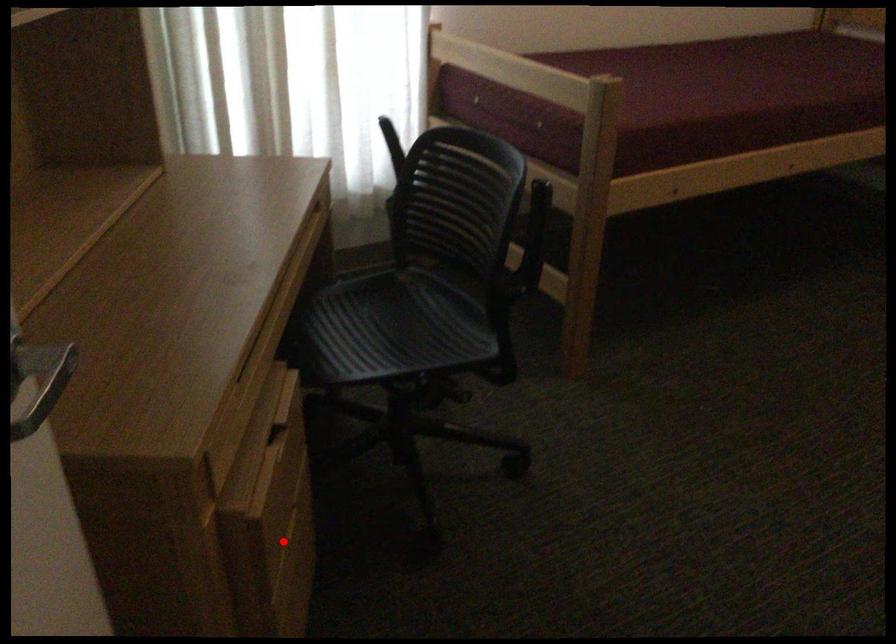
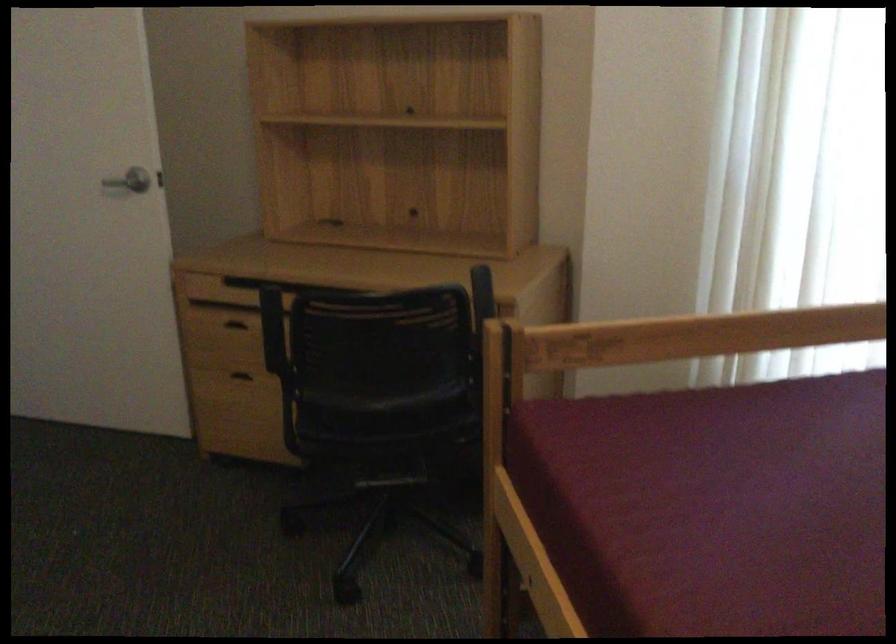
Question: I am providing you with two images of the same scene from different viewpoints. A red point is marked on the first image. At the location where the point appears in image 1, is it still visible in image 2?

Choices:
 (A) Yes
 (B) No

Answer: (A)